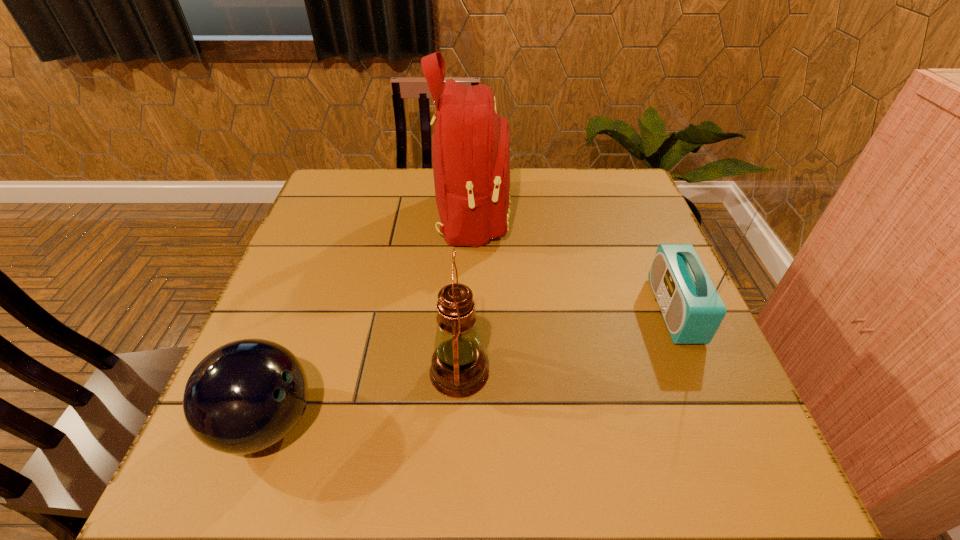
Where is `vacant space situated 0.080m on the back of the oil lamp`? vacant space situated 0.080m on the back of the oil lamp is located at coordinates (462, 314).

Find the location of `free location located on the side of the shortest object with the finger holes`. free location located on the side of the shortest object with the finger holes is located at coordinates (513, 422).

Locate an element on the screen. object present at the far edge is located at coordinates (471, 144).

Find the location of a particular element. object present at the near edge is located at coordinates (245, 396).

Locate an element on the screen. This screenshot has height=540, width=960. object at the left edge is located at coordinates (245, 396).

Locate an element on the screen. Image resolution: width=960 pixels, height=540 pixels. object present at the right edge is located at coordinates (693, 310).

Locate an element on the screen. The image size is (960, 540). object at the near left corner is located at coordinates (245, 396).

Where is `vacant area at the far edge`? vacant area at the far edge is located at coordinates (524, 208).

The width and height of the screenshot is (960, 540). I want to click on vacant space at the left edge of the desktop, so click(312, 254).

Where is `vacant area at the right edge`? This screenshot has width=960, height=540. vacant area at the right edge is located at coordinates (641, 252).